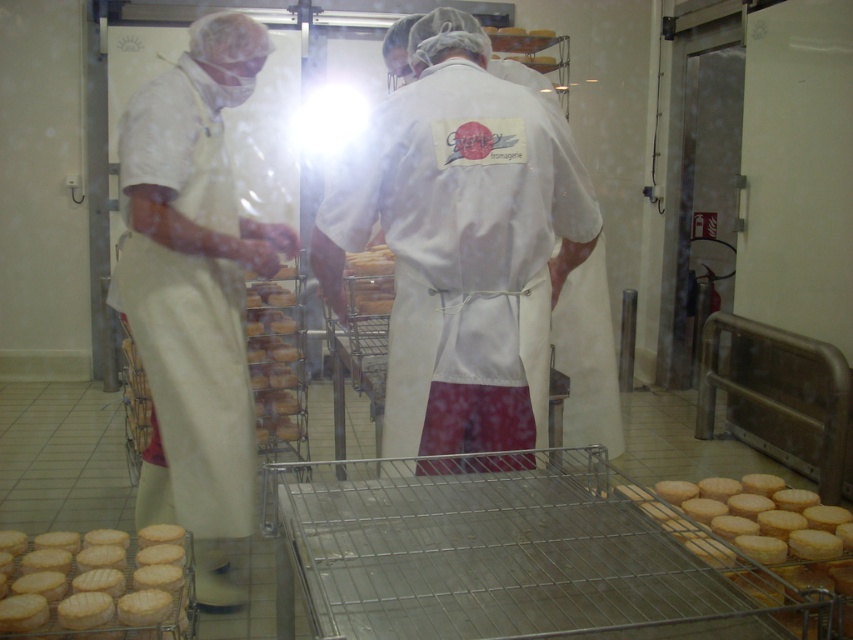
Is yellowish matte cheese at center in front of matte brown cheese at center?

No, yellowish matte cheese at center is further to the viewer.

Between point (293, 400) and point (386, 250), which one is positioned behind?

The point (293, 400) is behind.

The width and height of the screenshot is (853, 640). Find the location of `yellowish matte cheese at center`. yellowish matte cheese at center is located at coordinates (274, 362).

Which is below, white fabric coat at center or yellowish matte cheese at center?

yellowish matte cheese at center

Who is positioned more to the left, white fabric coat at center or yellowish matte cheese at center?

Positioned to the left is yellowish matte cheese at center.

The width and height of the screenshot is (853, 640). What are the coordinates of `white fabric coat at center` in the screenshot? It's located at (461, 243).

Find the location of a particular element. white fabric coat at center is located at coordinates (461, 243).

What do you see at coordinates (91, 588) in the screenshot?
I see `golden brown cheese at lower left` at bounding box center [91, 588].

Can you confirm if golden brown cheese at lower left is positioned to the right of yellowish matte cheese at center?

No, golden brown cheese at lower left is not to the right of yellowish matte cheese at center.

Is point (67, 600) positioned behind point (258, 356)?

No, (67, 600) is in front of (258, 356).

Locate an element on the screen. The width and height of the screenshot is (853, 640). golden brown cheese at lower left is located at coordinates (91, 588).